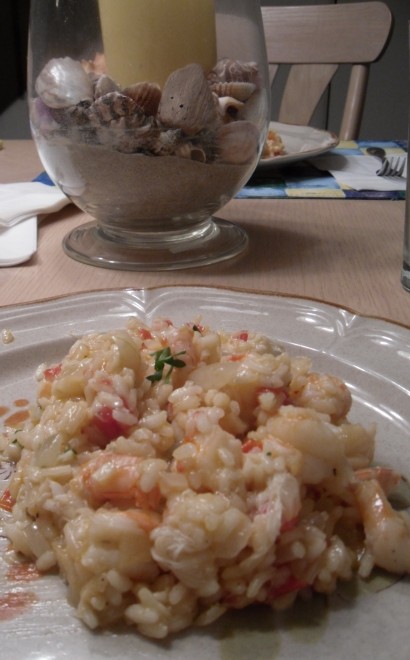
The image size is (410, 660). What are the coordinates of `gold rims on plate` in the screenshot? It's located at (311, 296), (311, 148).